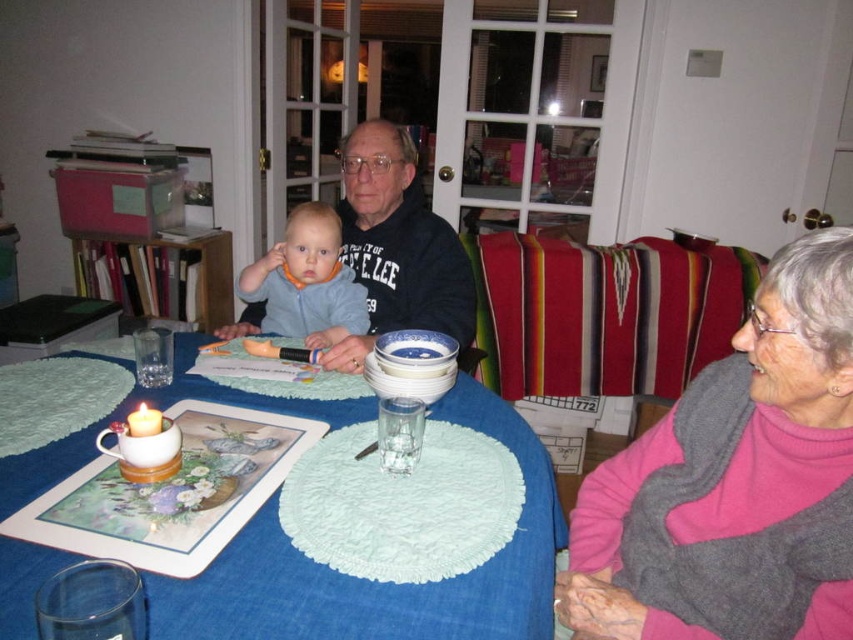
You are a guest at this dinner and want to place your napkin on your lap. Which item, the matte black sweater at center or the light blue fabric bib at center, is wider and thus more suitable for covering your lap?

The matte black sweater at center is wider than the light blue fabric bib at center, so it would be more suitable for covering your lap.

You are a guest at this dinner table and want to place your napkin on your lap. Which item from the scene is the correct one to use, the blue fabric table at center or the light blue fabric bib at center?

The light blue fabric bib at center is the correct item to use as a napkin because it is shorter than the blue fabric table at center, making it more suitable for placing on your lap.